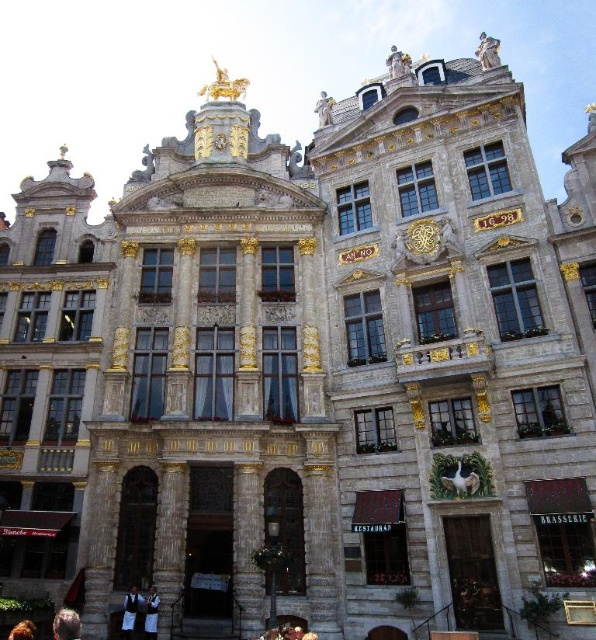
Question: Which of the following is the farthest from the observer?

Choices:
 (A) brown leather jacket at lower left
 (B) white cloth at center
 (C) white fabric at lower left

Answer: (C)

Question: Is the position of brown leather jacket at lower left less distant than that of blonde hair at lower left?

Choices:
 (A) yes
 (B) no

Answer: (A)

Question: Which point is closer to the camera?

Choices:
 (A) (17, 634)
 (B) (159, 600)

Answer: (A)

Question: Is white fabric at lower left above brown leather jacket at lower left?

Choices:
 (A) no
 (B) yes

Answer: (A)

Question: Does brown leather jacket at lower left have a lesser width compared to blonde hair at lower left?

Choices:
 (A) no
 (B) yes

Answer: (A)

Question: Which point is closer to the camera taking this photo?

Choices:
 (A) (154, 593)
 (B) (26, 628)
 (C) (79, 618)

Answer: (B)